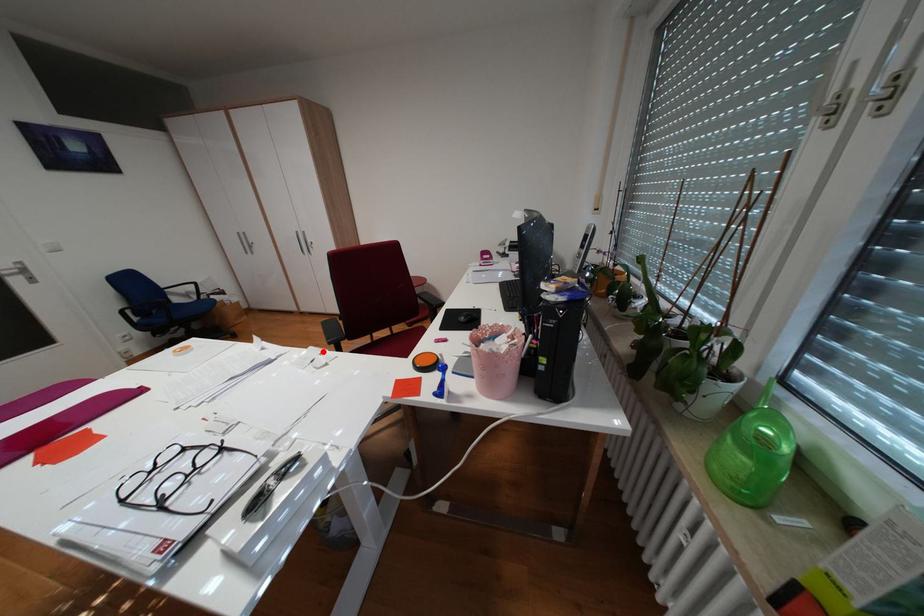
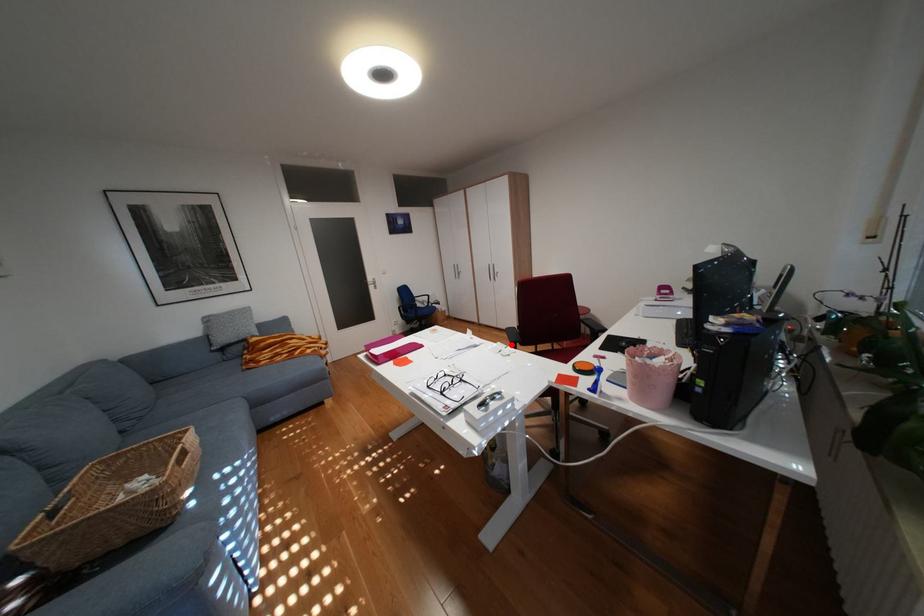
I am providing you with two images of the same scene from different viewpoints. A red point is marked on the first image and another point is marked on the second image. Are the points marked in image1 and image2 representing the same 3D position?

Yes